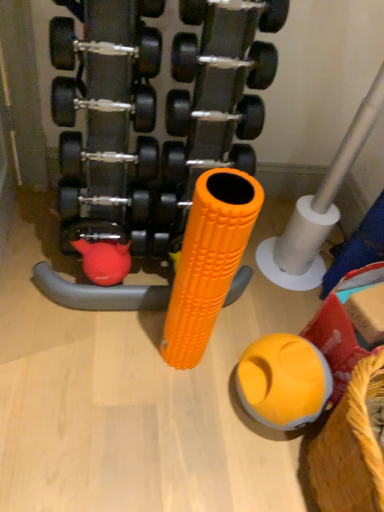
What do you see at coordinates (154, 113) in the screenshot?
I see `black rubber dumbbell at center` at bounding box center [154, 113].

At what (x,y) coordinates should I click in order to perform the action: click on black rubber dumbbell at center. Please return your answer as a coordinate pair (x, y). This screenshot has width=384, height=512. Looking at the image, I should click on (154, 113).

Does rubberized yellow ball at lower right have a lesser width compared to black rubber dumbbell at center?

Yes.

Between rubberized yellow ball at lower right and black rubber dumbbell at center, which one appears on the left side from the viewer's perspective?

black rubber dumbbell at center.

From the image's perspective, does rubberized yellow ball at lower right appear higher than black rubber dumbbell at center?

No.

Who is taller, rubberized yellow ball at lower right or black rubber dumbbell at center?

black rubber dumbbell at center.

Considering the sizes of objects silver metallic pipe at center right and black rubber dumbbell at center in the image provided, who is thinner, silver metallic pipe at center right or black rubber dumbbell at center?

Thinner between the two is silver metallic pipe at center right.

Between silver metallic pipe at center right and black rubber dumbbell at center, which one has more height?

black rubber dumbbell at center is taller.

Would you say black rubber dumbbell at center is part of silver metallic pipe at center right's contents?

No, black rubber dumbbell at center is not inside silver metallic pipe at center right.

Image resolution: width=384 pixels, height=512 pixels. I want to click on pipe below the black rubber dumbbell at center (from the image's perspective), so click(318, 208).

Considering the points (238, 373) and (325, 474), which point is behind, point (238, 373) or point (325, 474)?

The point (238, 373) is behind.

In the scene shown: How many degrees apart are the facing directions of rubberized yellow ball at lower right and yellow woven basket at lower right?

The angle between the facing direction of rubberized yellow ball at lower right and the facing direction of yellow woven basket at lower right is 6.98e-05 degrees.

Is rubberized yellow ball at lower right positioned with its back to yellow woven basket at lower right?

No, yellow woven basket at lower right is not at the back of rubberized yellow ball at lower right.

Considering the sizes of rubberized yellow ball at lower right and yellow woven basket at lower right in the image, is rubberized yellow ball at lower right taller or shorter than yellow woven basket at lower right?

Considering their sizes, rubberized yellow ball at lower right has less height than yellow woven basket at lower right.

From the picture: Relative to yellow woven basket at lower right, is silver metallic pipe at center right in front or behind?

silver metallic pipe at center right is positioned farther from the viewer than yellow woven basket at lower right.

Is silver metallic pipe at center right facing towards yellow woven basket at lower right?

Yes, silver metallic pipe at center right faces towards yellow woven basket at lower right.

Which is in front, point (341, 170) or point (378, 390)?

Positioned in front is point (378, 390).

From a real-world perspective, which object stands above the other?

silver metallic pipe at center right, from a real-world perspective.

Is black rubber dumbbell at center a part of yellow woven basket at lower right?

Actually, black rubber dumbbell at center is outside yellow woven basket at lower right.

Measure the distance from yellow woven basket at lower right to black rubber dumbbell at center.

They are 31.54 inches apart.

From the picture: Considering the relative sizes of yellow woven basket at lower right and black rubber dumbbell at center in the image provided, is yellow woven basket at lower right thinner than black rubber dumbbell at center?

Yes.

Can you see yellow woven basket at lower right touching black rubber dumbbell at center?

No, yellow woven basket at lower right is not making contact with black rubber dumbbell at center.

Does point (363, 375) come closer to viewer compared to point (257, 340)?

Yes, point (363, 375) is closer to viewer.

Locate an element on the screen. The height and width of the screenshot is (512, 384). basket located above the rubberized yellow ball at lower right (from a real-world perspective) is located at coordinates (350, 447).

Which object is closer to the camera taking this photo, yellow woven basket at lower right or rubberized yellow ball at lower right?

yellow woven basket at lower right is closer to the camera.

Is yellow woven basket at lower right facing away from rubberized yellow ball at lower right?

That's not correct — yellow woven basket at lower right is not looking away from rubberized yellow ball at lower right.

From the image's perspective, between black rubber dumbbell at center and yellow woven basket at lower right, who is located below?

yellow woven basket at lower right.

From a real-world perspective, is black rubber dumbbell at center located higher than yellow woven basket at lower right?

Yes.

Looking at the image, does black rubber dumbbell at center seem bigger or smaller compared to yellow woven basket at lower right?

Clearly, black rubber dumbbell at center is larger in size than yellow woven basket at lower right.

Where is `basket lying below the black rubber dumbbell at center (from the image's perspective)`? The image size is (384, 512). basket lying below the black rubber dumbbell at center (from the image's perspective) is located at coordinates (350, 447).

In order to click on dumbbell positioned vertically above the rubberized yellow ball at lower right (from a real-world perspective) in this screenshot , I will do `click(154, 113)`.

At what (x,y) coordinates should I click in order to perform the action: click on dumbbell that is in front of the silver metallic pipe at center right. Please return your answer as a coordinate pair (x, y). Looking at the image, I should click on (154, 113).

Which object lies nearer to the anchor point rubberized yellow ball at lower right, black rubber dumbbell at center or yellow woven basket at lower right?

Among the two, yellow woven basket at lower right is located nearer to rubberized yellow ball at lower right.

Estimate the real-world distances between objects in this image. Which object is closer to yellow woven basket at lower right, silver metallic pipe at center right or rubberized yellow ball at lower right?

rubberized yellow ball at lower right lies closer to yellow woven basket at lower right than the other object.

Considering their positions, is yellow woven basket at lower right positioned further to black rubber dumbbell at center than rubberized yellow ball at lower right?

Among the two, yellow woven basket at lower right is located further to black rubber dumbbell at center.

Based on their spatial positions, is yellow woven basket at lower right or silver metallic pipe at center right closer to rubberized yellow ball at lower right?

yellow woven basket at lower right is closer to rubberized yellow ball at lower right.

Consider the image. Estimate the real-world distances between objects in this image. Which object is further from black rubber dumbbell at center, rubberized yellow ball at lower right or yellow woven basket at lower right?

Among the two, yellow woven basket at lower right is located further to black rubber dumbbell at center.

From the image, which object appears to be nearer to black rubber dumbbell at center, yellow woven basket at lower right or silver metallic pipe at center right?

silver metallic pipe at center right is closer to black rubber dumbbell at center.

Looking at the image, which one is located further to black rubber dumbbell at center, silver metallic pipe at center right or rubberized yellow ball at lower right?

rubberized yellow ball at lower right is positioned further to the anchor black rubber dumbbell at center.

Which object lies nearer to the anchor point black rubber dumbbell at center, silver metallic pipe at center right or yellow woven basket at lower right?

silver metallic pipe at center right is closer to black rubber dumbbell at center.

You are a GUI agent. You are given a task and a screenshot of the screen. Output one action in this format:
    pyautogui.click(x=<x>, y=<y>)
    Task: Click on the pipe between black rubber dumbbell at center and yellow woven basket at lower right vertically
    Image resolution: width=384 pixels, height=512 pixels.
    Given the screenshot: What is the action you would take?
    pyautogui.click(x=318, y=208)

Image resolution: width=384 pixels, height=512 pixels. I want to click on pipe between black rubber dumbbell at center and rubberized yellow ball at lower right in the up-down direction, so click(318, 208).

This screenshot has height=512, width=384. I want to click on toy between silver metallic pipe at center right and yellow woven basket at lower right from top to bottom, so click(283, 381).

Find the location of `toy between black rubber dumbbell at center and yellow woven basket at lower right in the up-down direction`. toy between black rubber dumbbell at center and yellow woven basket at lower right in the up-down direction is located at coordinates (283, 381).